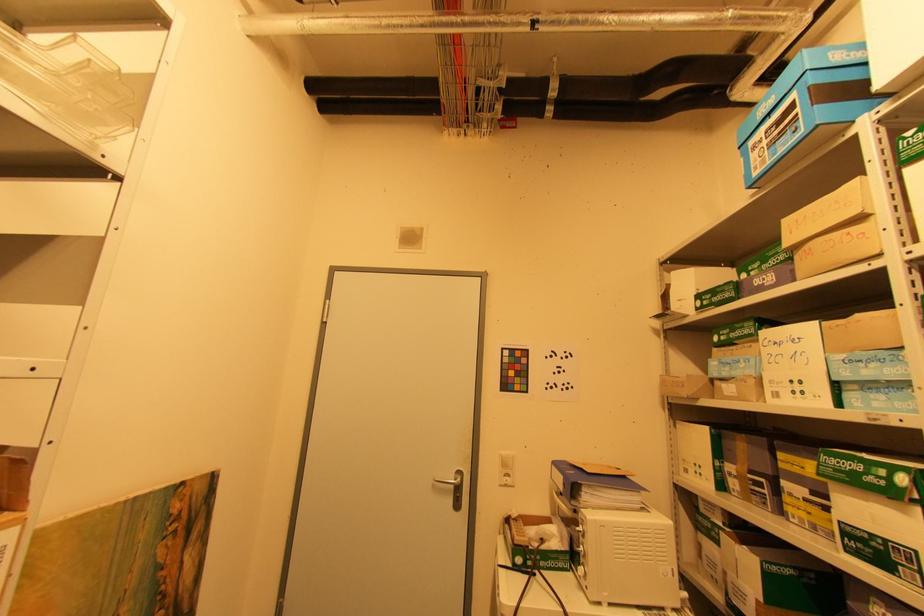
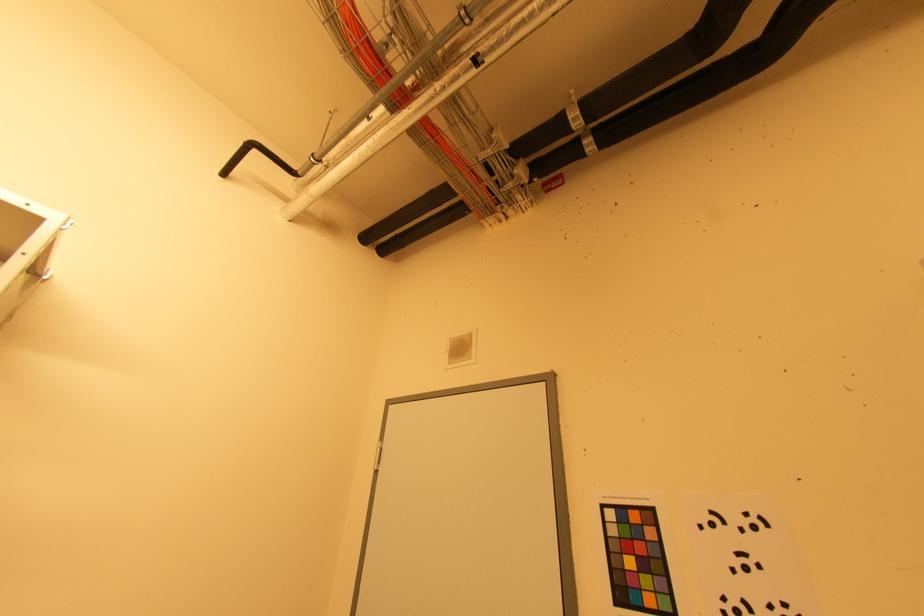
Based on the continuous images, in which direction is the camera rotating?

The camera's rotation is toward left-up.